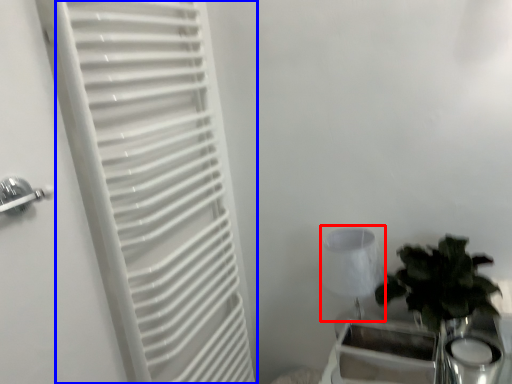
Question: Among these objects, which one is nearest to the camera, lamp (highlighted by a red box) or curtain (highlighted by a blue box)?

Choices:
 (A) lamp
 (B) curtain

Answer: (B)